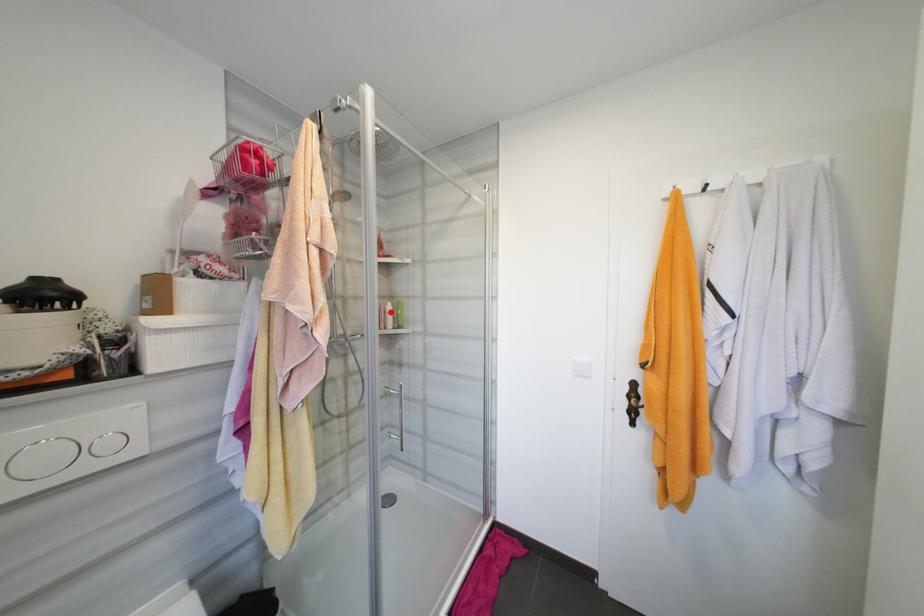
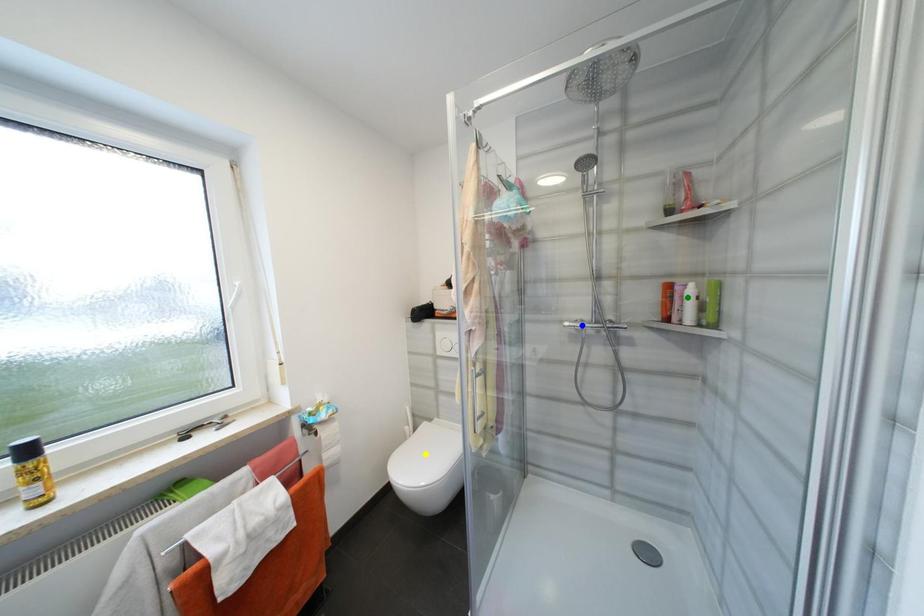
Question: I am providing you with two images of the same scene from different viewpoints. A red point is marked on the first image. You are given multiple points on the second image. Which spot in image 2 lines up with the point in image 1?

Choices:
 (A) blue point
 (B) yellow point
 (C) green point

Answer: (C)